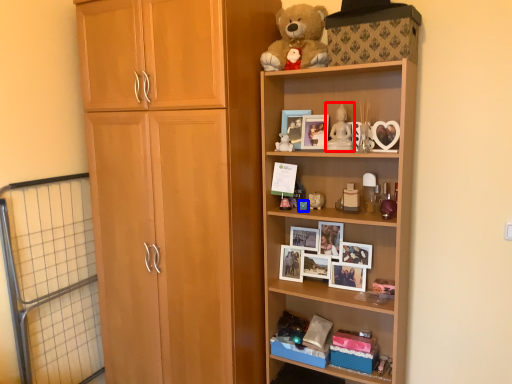
Question: Among these objects, which one is nearest to the camera, toy (highlighted by a red box) or toy (highlighted by a blue box)?

Choices:
 (A) toy
 (B) toy

Answer: (A)